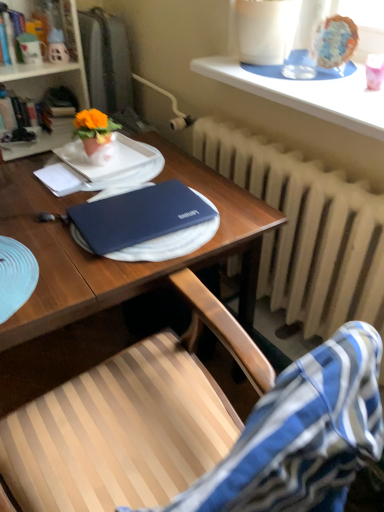
In order to click on vacant area in front of blue matte laptop at center in this screenshot , I will do `click(105, 273)`.